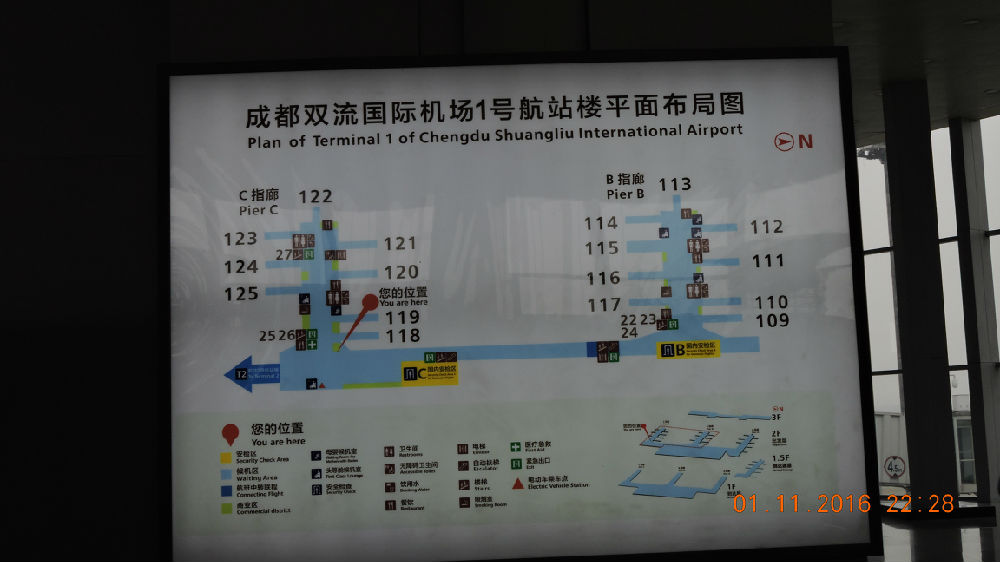
Find the location of a particular element. tv frame bottom is located at coordinates (529, 560).